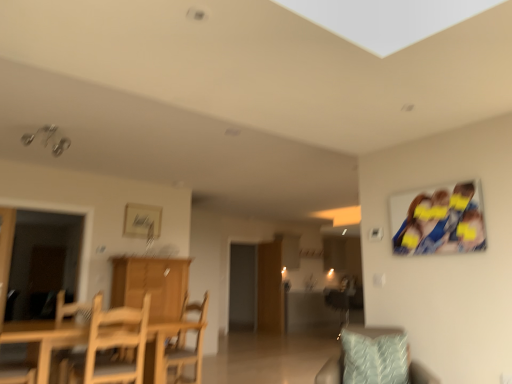
The width and height of the screenshot is (512, 384). In order to click on vacant point above blue fabric photo at upper right (from a real-world perspective) in this screenshot , I will do `click(431, 187)`.